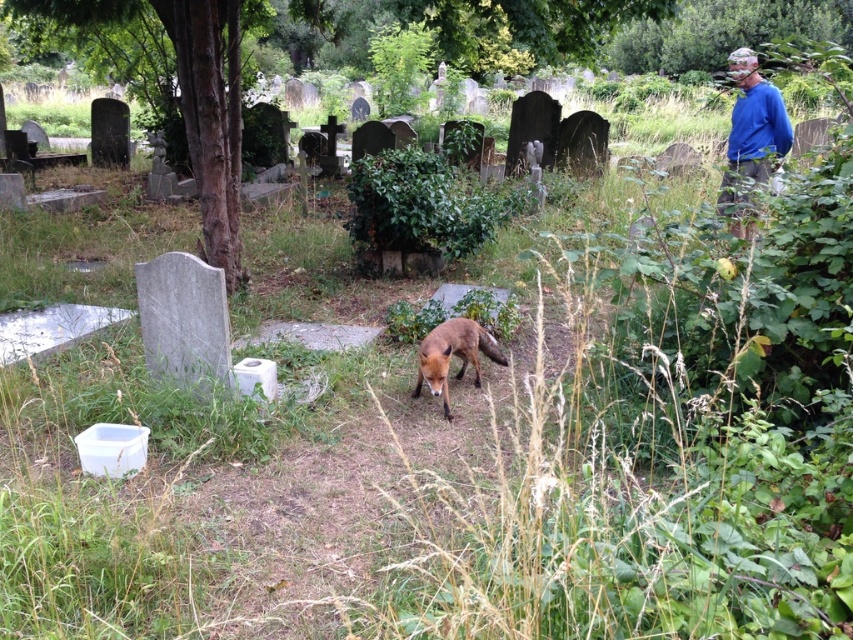
Between point (735, 132) and point (461, 344), which one is positioned behind?

Point (735, 132)

Does blue cotton shirt at upper right appear over reddish-brown fur fox at center?

Yes.

Does point (744, 147) come farther from viewer compared to point (454, 328)?

Yes.

Locate an element on the screen. blue cotton shirt at upper right is located at coordinates (752, 125).